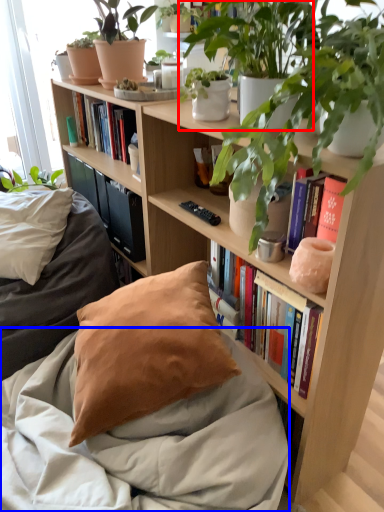
Question: Which object is further to the camera taking this photo, houseplant (highlighted by a red box) or blanket (highlighted by a blue box)?

Choices:
 (A) houseplant
 (B) blanket

Answer: (A)